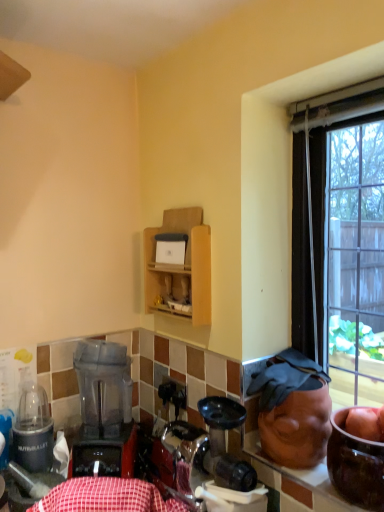
In order to face red checkered tablecloth at lower center, should I rotate leftwards or rightwards?

Turn left by 11.166 degrees to look at red checkered tablecloth at lower center.

Describe the element at coordinates (104, 411) in the screenshot. I see `translucent plastic blender at lower left` at that location.

Image resolution: width=384 pixels, height=512 pixels. Find the location of `wooden cabinet at upper center`. wooden cabinet at upper center is located at coordinates (181, 266).

You are a GUI agent. You are given a task and a screenshot of the screen. Output one action in this format:
    pyautogui.click(x=<x>, y=<y>)
    Task: Click on the red checkered tablecloth at lower center
    This screenshot has height=512, width=384.
    Given the screenshot: What is the action you would take?
    pyautogui.click(x=106, y=497)

Measure the distance between wooden cabinet at upper center and metallic silver blender at left.

60.29 centimeters.

Between wooden cabinet at upper center and metallic silver blender at left, which one is positioned behind?

wooden cabinet at upper center is more distant.

Between wooden cabinet at upper center and metallic silver blender at left, which one has more height?

wooden cabinet at upper center is taller.

Is point (148, 289) farther from viewer compared to point (32, 446)?

Yes.

Does translucent plastic blender at lower left have a lesser width compared to red checkered tablecloth at lower center?

No.

Is translucent plastic blender at lower left positioned far away from red checkered tablecloth at lower center?

translucent plastic blender at lower left is actually quite close to red checkered tablecloth at lower center.

From the picture: Does translucent plastic blender at lower left come behind red checkered tablecloth at lower center?

Yes, it is.

Is translucent plastic blender at lower left bigger than red checkered tablecloth at lower center?

Yes.

From a real-world perspective, is wooden cabinet at upper center physically located above or below red checkered tablecloth at lower center?

In terms of real-world spatial position, wooden cabinet at upper center is above red checkered tablecloth at lower center.

Is red checkered tablecloth at lower center at the back of wooden cabinet at upper center?

No, wooden cabinet at upper center's orientation is not away from red checkered tablecloth at lower center.

From the image's perspective, is wooden cabinet at upper center located above or below red checkered tablecloth at lower center?

From the image's perspective, wooden cabinet at upper center appears above red checkered tablecloth at lower center.

How much distance is there between translucent plastic blender at lower left and wooden cabinet at upper center?

translucent plastic blender at lower left is 36.95 centimeters away from wooden cabinet at upper center.

How many degrees apart are the facing directions of translucent plastic blender at lower left and wooden cabinet at upper center?

translucent plastic blender at lower left and wooden cabinet at upper center are facing 52.9 degrees away from each other.

From their relative heights in the image, would you say translucent plastic blender at lower left is taller or shorter than wooden cabinet at upper center?

Clearly, translucent plastic blender at lower left is taller compared to wooden cabinet at upper center.

Which object is positioned more to the left, translucent plastic blender at lower left or wooden cabinet at upper center?

From the viewer's perspective, translucent plastic blender at lower left appears more on the left side.

Is metallic silver blender at left bigger or smaller than red checkered tablecloth at lower center?

Considering their sizes, metallic silver blender at left takes up less space than red checkered tablecloth at lower center.

Is point (26, 458) behind point (91, 501)?

Yes, point (26, 458) is farther from viewer.

Considering the sizes of metallic silver blender at left and red checkered tablecloth at lower center in the image, is metallic silver blender at left taller or shorter than red checkered tablecloth at lower center?

Clearly, metallic silver blender at left is taller compared to red checkered tablecloth at lower center.

Which of these two, metallic silver blender at left or red checkered tablecloth at lower center, is thinner?

metallic silver blender at left is thinner.

Which of these two, red checkered tablecloth at lower center or wooden cabinet at upper center, is wider?

Wider between the two is red checkered tablecloth at lower center.

Is red checkered tablecloth at lower center in contact with wooden cabinet at upper center?

No, red checkered tablecloth at lower center is not in contact with wooden cabinet at upper center.

From the image's perspective, which object appears higher, red checkered tablecloth at lower center or wooden cabinet at upper center?

wooden cabinet at upper center is shown above in the image.

Would you say translucent plastic blender at lower left is part of wooden cabinet at upper center's contents?

Definitely not — translucent plastic blender at lower left is not inside wooden cabinet at upper center.

Locate an element on the screen. cabinetry behind the translucent plastic blender at lower left is located at coordinates (181, 266).

From a real-world perspective, is wooden cabinet at upper center physically located above or below translucent plastic blender at lower left?

wooden cabinet at upper center is above translucent plastic blender at lower left.

Does point (167, 212) appear closer or farther from the camera than point (84, 388)?

Point (167, 212) appears to be farther away from the viewer than point (84, 388).

Where is `cabinetry above the metallic silver blender at left (from a real-world perspective)`? This screenshot has width=384, height=512. cabinetry above the metallic silver blender at left (from a real-world perspective) is located at coordinates [181, 266].

I want to click on tablecloth located underneath the translucent plastic blender at lower left (from a real-world perspective), so click(x=106, y=497).

Which object lies further to the anchor point translucent plastic blender at lower left, metallic silver blender at left or red checkered tablecloth at lower center?

red checkered tablecloth at lower center.

Looking at the image, which one is located closer to red checkered tablecloth at lower center, wooden cabinet at upper center or metallic silver blender at left?

Among the two, metallic silver blender at left is located nearer to red checkered tablecloth at lower center.

Estimate the real-world distances between objects in this image. Which object is closer to wooden cabinet at upper center, red checkered tablecloth at lower center or translucent plastic blender at lower left?

The object closer to wooden cabinet at upper center is translucent plastic blender at lower left.

From the image, which object appears to be farther from translucent plastic blender at lower left, wooden cabinet at upper center or metallic silver blender at left?

wooden cabinet at upper center.

Estimate the real-world distances between objects in this image. Which object is further from metallic silver blender at left, red checkered tablecloth at lower center or wooden cabinet at upper center?

Among the two, wooden cabinet at upper center is located further to metallic silver blender at left.

When comparing their distances from wooden cabinet at upper center, does red checkered tablecloth at lower center or metallic silver blender at left seem further?

Based on the image, metallic silver blender at left appears to be further to wooden cabinet at upper center.

Looking at the image, which one is located further to metallic silver blender at left, red checkered tablecloth at lower center or translucent plastic blender at lower left?

Among the two, red checkered tablecloth at lower center is located further to metallic silver blender at left.

Looking at the image, which one is located further to metallic silver blender at left, wooden cabinet at upper center or red checkered tablecloth at lower center?

Based on the image, wooden cabinet at upper center appears to be further to metallic silver blender at left.

This screenshot has height=512, width=384. In order to click on blender between wooden cabinet at upper center and metallic silver blender at left from top to bottom in this screenshot , I will do `click(104, 411)`.

Where is `appliance between wooden cabinet at upper center and red checkered tablecloth at lower center vertically`? appliance between wooden cabinet at upper center and red checkered tablecloth at lower center vertically is located at coordinates (33, 430).

In order to click on blender that lies between wooden cabinet at upper center and red checkered tablecloth at lower center from top to bottom in this screenshot , I will do `click(104, 411)`.

This screenshot has height=512, width=384. What are the coordinates of `blender between metallic silver blender at left and red checkered tablecloth at lower center in the horizontal direction` in the screenshot? It's located at (104, 411).